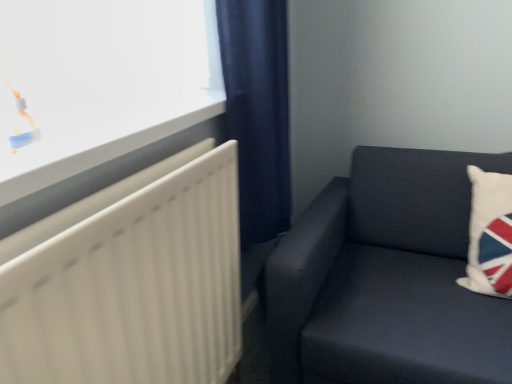
Question: Is point (72, 109) positioned closer to the camera than point (182, 240)?

Choices:
 (A) closer
 (B) farther

Answer: (A)

Question: In terms of height, does white glossy window at upper left look taller or shorter compared to white matte radiator at left?

Choices:
 (A) tall
 (B) short

Answer: (B)

Question: Which is farther from the navy blue fabric curtain at center?

Choices:
 (A) white glossy window at upper left
 (B) white matte radiator at left
 (C) dark fabric couch at right
 (D) white fabric pillow at right

Answer: (D)

Question: Estimate the real-world distances between objects in this image. Which object is farther from the white glossy window at upper left?

Choices:
 (A) white matte radiator at left
 (B) dark fabric couch at right
 (C) navy blue fabric curtain at center
 (D) white fabric pillow at right

Answer: (D)